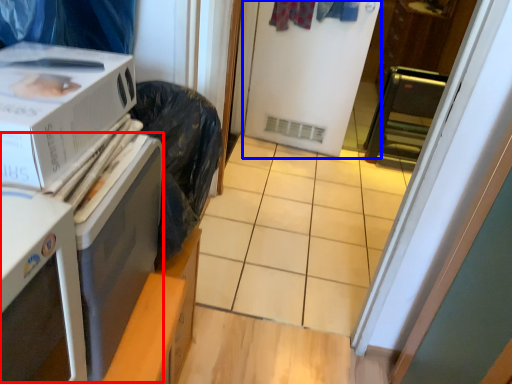
Question: Which object appears farthest to the camera in this image, appliance (highlighted by a red box) or screen door (highlighted by a blue box)?

Choices:
 (A) appliance
 (B) screen door

Answer: (B)